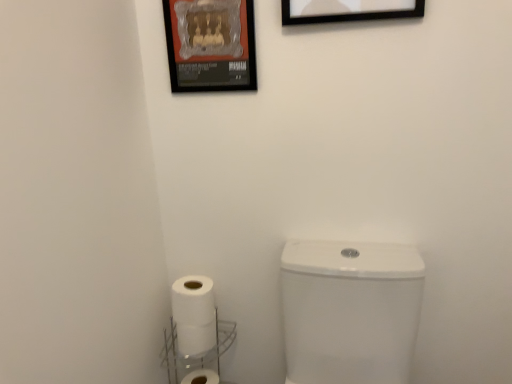
Question: From a real-world perspective, is white glossy toilet at lower right positioned over black matte picture frame at upper center, which appears as the 1th picture frame when viewed from the right, based on gravity?

Choices:
 (A) yes
 (B) no

Answer: (B)

Question: From the image's perspective, is white glossy toilet at lower right located above black matte picture frame at upper center, positioned as the first picture frame in front-to-back order?

Choices:
 (A) no
 (B) yes

Answer: (A)

Question: Are white glossy toilet at lower right and black matte picture frame at upper center, which is the second picture frame in left-to-right order, beside each other?

Choices:
 (A) yes
 (B) no

Answer: (B)

Question: Is white glossy toilet at lower right at the right side of black matte picture frame at upper center, the second picture frame when ordered from back to front?

Choices:
 (A) no
 (B) yes

Answer: (A)

Question: Is white glossy toilet at lower right taller than black matte picture frame at upper center, which appears as the 1th picture frame when viewed from the right?

Choices:
 (A) no
 (B) yes

Answer: (B)

Question: Is metallic poster at upper center, acting as the first picture frame starting from the left, in front of or behind white plastic shelf at lower center in the image?

Choices:
 (A) front
 (B) behind

Answer: (A)

Question: From a real-world perspective, is metallic poster at upper center, acting as the first picture frame starting from the left, above or below white plastic shelf at lower center?

Choices:
 (A) below
 (B) above

Answer: (B)

Question: Is metallic poster at upper center, positioned as the second picture frame in right-to-left order, inside or outside of white plastic shelf at lower center?

Choices:
 (A) outside
 (B) inside

Answer: (A)

Question: In terms of size, does metallic poster at upper center, positioned as the second picture frame in right-to-left order, appear bigger or smaller than white plastic shelf at lower center?

Choices:
 (A) big
 (B) small

Answer: (B)

Question: From a real-world perspective, is metallic poster at upper center, the 2th picture frame from the front, physically located above or below black matte picture frame at upper center, positioned as the first picture frame in front-to-back order?

Choices:
 (A) above
 (B) below

Answer: (B)

Question: Based on their positions, is metallic poster at upper center, the 2th picture frame from the front, located to the left or right of black matte picture frame at upper center, the second picture frame when ordered from back to front?

Choices:
 (A) right
 (B) left

Answer: (B)

Question: Considering their positions, is metallic poster at upper center, acting as the first picture frame starting from the left, located in front of or behind black matte picture frame at upper center, positioned as the first picture frame in front-to-back order?

Choices:
 (A) behind
 (B) front

Answer: (A)

Question: From their relative heights in the image, would you say metallic poster at upper center, the 2th picture frame from the front, is taller or shorter than black matte picture frame at upper center, which appears as the 1th picture frame when viewed from the right?

Choices:
 (A) short
 (B) tall

Answer: (A)

Question: In terms of size, does white glossy toilet at lower right appear bigger or smaller than black matte picture frame at upper center, which is the second picture frame in left-to-right order?

Choices:
 (A) small
 (B) big

Answer: (B)

Question: From a real-world perspective, is white glossy toilet at lower right above or below black matte picture frame at upper center, which is the second picture frame in left-to-right order?

Choices:
 (A) above
 (B) below

Answer: (B)